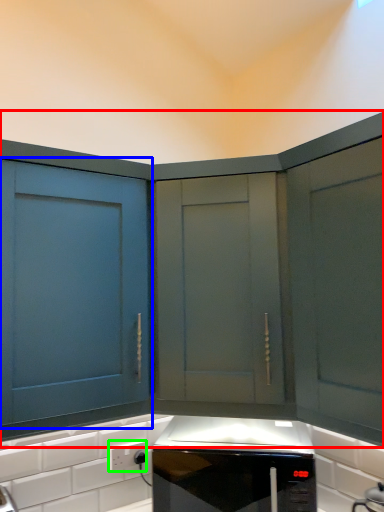
Question: Considering the real-world distances, which object is closest to cabinetry (highlighted by a red box)? cabinetry (highlighted by a blue box) or electric outlet (highlighted by a green box).

Choices:
 (A) cabinetry
 (B) electric outlet

Answer: (A)